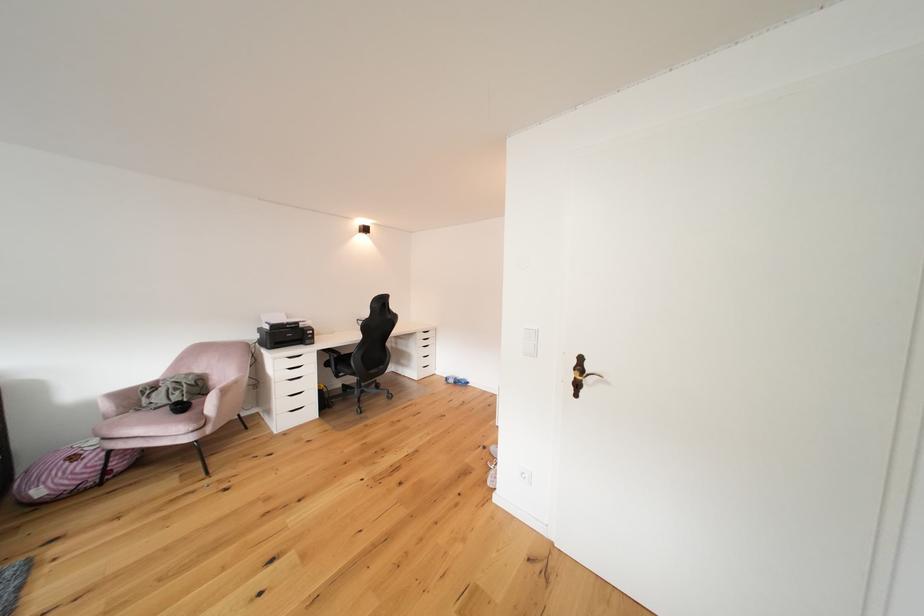
Locate an element on the screen. Image resolution: width=924 pixels, height=616 pixels. black drawer handle is located at coordinates (301, 408).